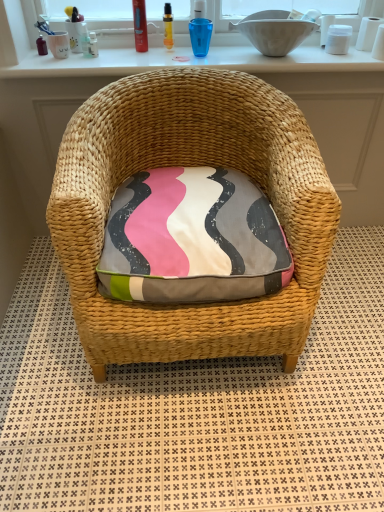
Where is `vacant region under white ceramic bowl at upper center (from a real-world perspective)`? The height and width of the screenshot is (512, 384). vacant region under white ceramic bowl at upper center (from a real-world perspective) is located at coordinates (257, 56).